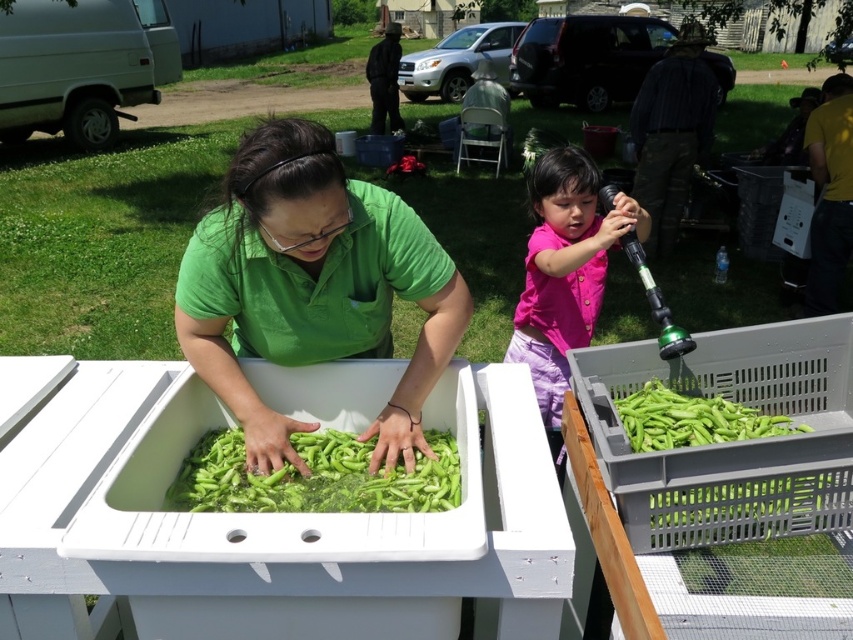
Is point (778, 509) positioned before point (729, 413)?

Yes, it is in front of point (729, 413).

What do you see at coordinates (750, 508) in the screenshot?
I see `green plastic crate at lower right` at bounding box center [750, 508].

Between point (670, 524) and point (697, 406), which one is positioned in front?

Point (670, 524) is more forward.

Image resolution: width=853 pixels, height=640 pixels. I want to click on green plastic crate at lower right, so click(750, 508).

Based on the photo, is green matte beans at center to the left of green plastic crate at lower right from the viewer's perspective?

Yes, green matte beans at center is to the left of green plastic crate at lower right.

Is green matte beans at center thinner than green plastic crate at lower right?

No, green matte beans at center is not thinner than green plastic crate at lower right.

Does point (369, 497) lie behind point (813, 483)?

Yes, it is behind point (813, 483).

Locate an element on the screen. green matte beans at center is located at coordinates (314, 477).

Which is below, pink matte shirt at upper right or green matte beans at center?

green matte beans at center is lower down.

How much distance is there between pink matte shirt at upper right and green matte beans at center?

pink matte shirt at upper right is 75.66 centimeters from green matte beans at center.

Locate an element on the screen. The image size is (853, 640). pink matte shirt at upper right is located at coordinates (564, 269).